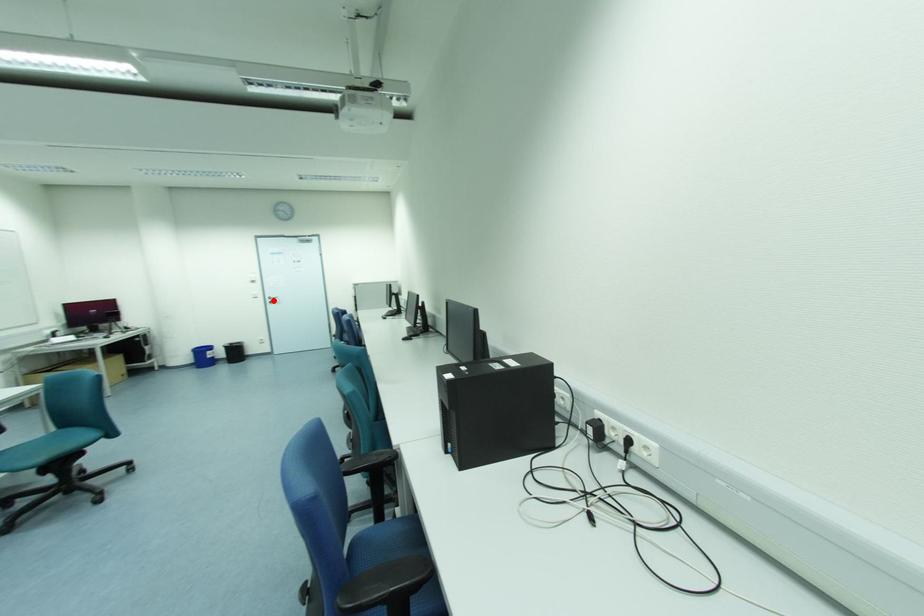
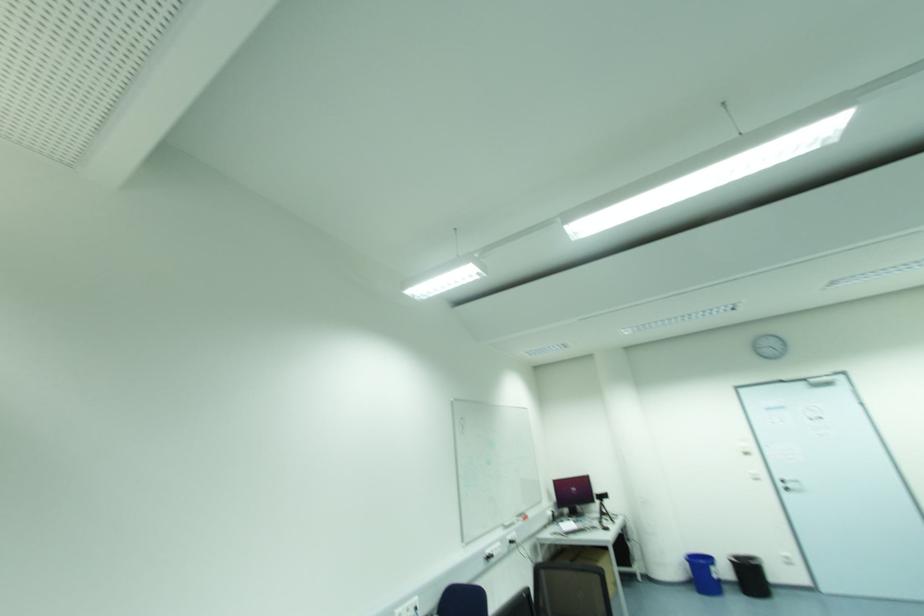
The point at the highlighted location is marked in the first image. Where is the corresponding point in the second image?

(789, 485)